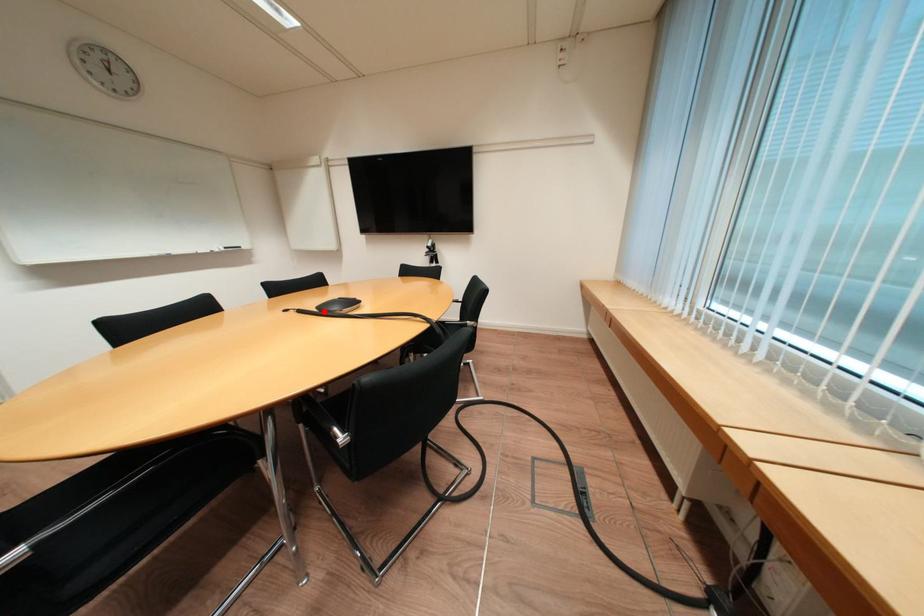
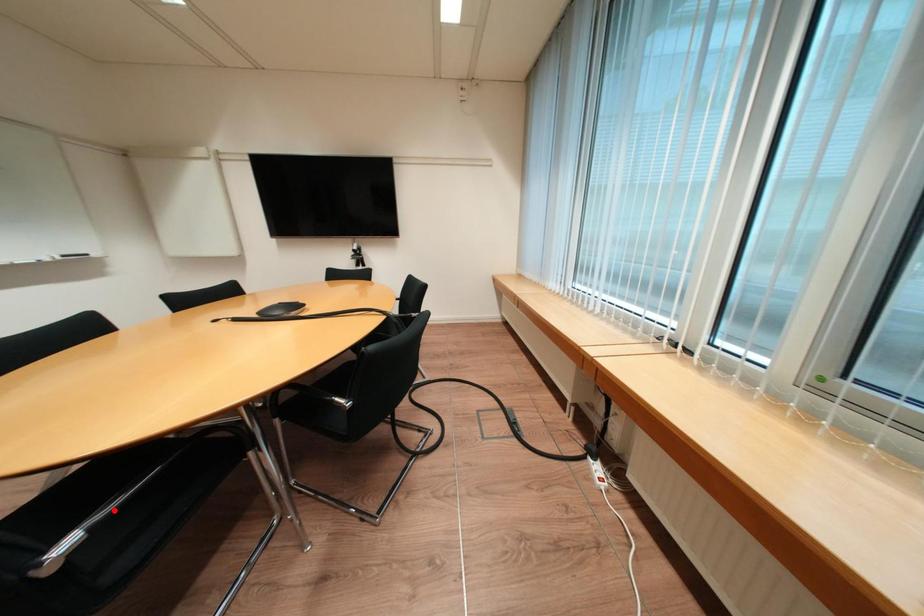
I am providing you with two images of the same scene from different viewpoints. A red point is marked on the first image and another point is marked on the second image. Are the points marked in image1 and image2 representing the same 3D position?

No